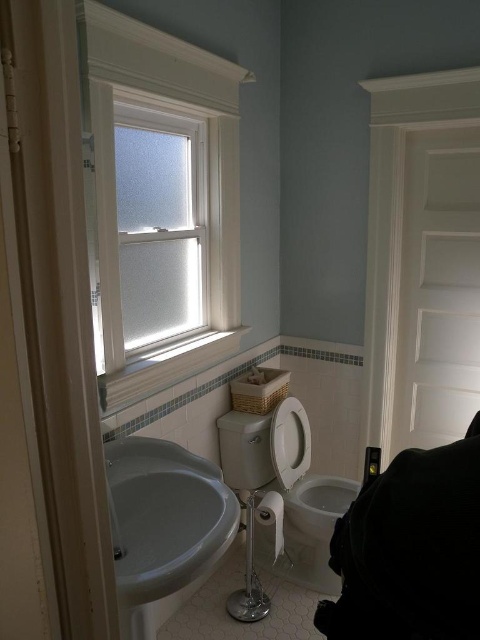
Does point (214, 252) come closer to viewer compared to point (207, 536)?

No, (214, 252) is behind (207, 536).

Is white frosted glass window at upper left bigger than white glossy sink at lower left?

Yes, white frosted glass window at upper left is bigger than white glossy sink at lower left.

Does point (162, 337) lie behind point (144, 577)?

Yes, it is behind point (144, 577).

You are a GUI agent. You are given a task and a screenshot of the screen. Output one action in this format:
    pyautogui.click(x=<x>, y=<y>)
    Task: Click on the white frosted glass window at upper left
    The height and width of the screenshot is (640, 480).
    Given the screenshot: What is the action you would take?
    pyautogui.click(x=159, y=205)

Is white frosted glass window at upper left positioned before white glossy toilet bowl at center?

Yes, white frosted glass window at upper left is closer to the viewer.

What do you see at coordinates (159, 205) in the screenshot?
I see `white frosted glass window at upper left` at bounding box center [159, 205].

Is point (203, 80) farther from viewer compared to point (284, 520)?

No, (203, 80) is in front of (284, 520).

This screenshot has width=480, height=640. What are the coordinates of `white frosted glass window at upper left` in the screenshot? It's located at (159, 205).

Can you confirm if white glossy sink at lower left is smaller than white glossy toilet bowl at center?

Correct, white glossy sink at lower left occupies less space than white glossy toilet bowl at center.

Which is above, white glossy sink at lower left or white glossy toilet bowl at center?

white glossy sink at lower left

Is point (197, 529) positioned behind point (319, 497)?

No, (197, 529) is closer to viewer.

At what (x,y) coordinates should I click in order to perform the action: click on white glossy sink at lower left. Please return your answer as a coordinate pair (x, y). The height and width of the screenshot is (640, 480). Looking at the image, I should click on (163, 524).